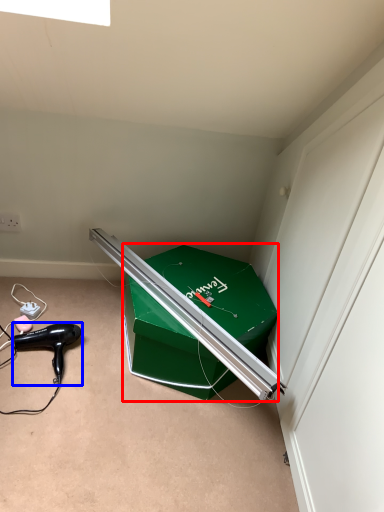
Question: Which object appears farthest to the camera in this image, box (highlighted by a red box) or hair drier (highlighted by a blue box)?

Choices:
 (A) box
 (B) hair drier

Answer: (B)